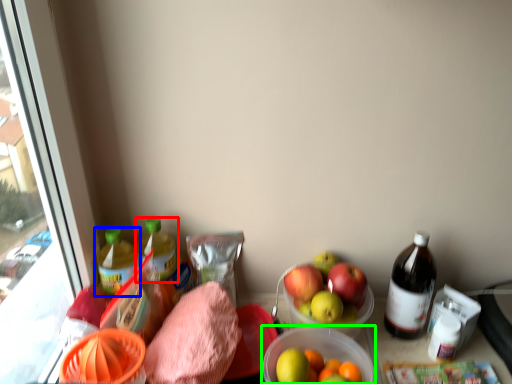
Question: Based on their relative distances, which object is farther from bottle (highlighted by a red box)? Choose from bottle (highlighted by a blue box) and bowl (highlighted by a green box).

Choices:
 (A) bottle
 (B) bowl

Answer: (B)